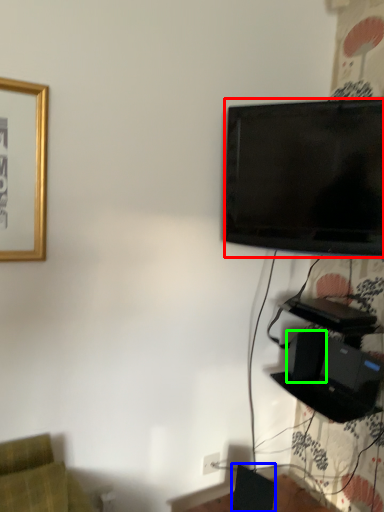
Question: Which object is the closest to the television (highlighted by a red box)? Choose among these: speaker (highlighted by a blue box) or speaker (highlighted by a green box).

Choices:
 (A) speaker
 (B) speaker

Answer: (B)